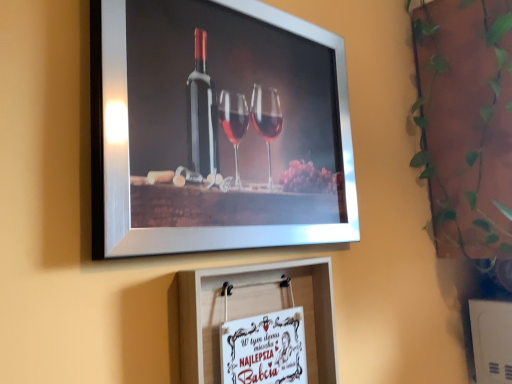
Question: Does white paper at center, arranged as the 2th picture frame when viewed from the top, appear on the left side of metallic silver picture frame at upper center, the 1th picture frame from the top?

Choices:
 (A) no
 (B) yes

Answer: (A)

Question: Is white paper at center, placed as the 1th picture frame when sorted from bottom to top, positioned behind metallic silver picture frame at upper center, the 1th picture frame from the top?

Choices:
 (A) yes
 (B) no

Answer: (A)

Question: Can you confirm if white paper at center, placed as the 1th picture frame when sorted from bottom to top, is smaller than metallic silver picture frame at upper center, the 1th picture frame from the top?

Choices:
 (A) yes
 (B) no

Answer: (A)

Question: From the image's perspective, is white paper at center, placed as the 1th picture frame when sorted from bottom to top, beneath metallic silver picture frame at upper center, the 1th picture frame from the top?

Choices:
 (A) no
 (B) yes

Answer: (B)

Question: From the image's perspective, is white paper at center, arranged as the 2th picture frame when viewed from the top, above metallic silver picture frame at upper center, the 1th picture frame from the top?

Choices:
 (A) no
 (B) yes

Answer: (A)

Question: Looking at the image, does green leafy plant at upper right seem bigger or smaller compared to white paper at center, arranged as the 2th picture frame when viewed from the top?

Choices:
 (A) big
 (B) small

Answer: (A)

Question: From a real-world perspective, is green leafy plant at upper right positioned above or below white paper at center, arranged as the 2th picture frame when viewed from the top?

Choices:
 (A) below
 (B) above

Answer: (B)

Question: Looking at their shapes, would you say green leafy plant at upper right is wider or thinner than white paper at center, placed as the 1th picture frame when sorted from bottom to top?

Choices:
 (A) thin
 (B) wide

Answer: (B)

Question: Is green leafy plant at upper right in front of or behind white paper at center, placed as the 1th picture frame when sorted from bottom to top, in the image?

Choices:
 (A) front
 (B) behind

Answer: (B)

Question: Do you think green leafy plant at upper right is within metallic silver picture frame at upper center, placed as the second picture frame when sorted from bottom to top, or outside of it?

Choices:
 (A) inside
 (B) outside

Answer: (B)

Question: Considering their positions, is green leafy plant at upper right located in front of or behind metallic silver picture frame at upper center, placed as the second picture frame when sorted from bottom to top?

Choices:
 (A) behind
 (B) front

Answer: (A)

Question: Considering the positions of green leafy plant at upper right and metallic silver picture frame at upper center, the 1th picture frame from the top, in the image, is green leafy plant at upper right wider or thinner than metallic silver picture frame at upper center, the 1th picture frame from the top,?

Choices:
 (A) thin
 (B) wide

Answer: (B)

Question: Considering the positions of point (437, 231) and point (118, 64), is point (437, 231) closer or farther from the camera than point (118, 64)?

Choices:
 (A) farther
 (B) closer

Answer: (A)

Question: Considering the positions of metallic silver picture frame at upper center, placed as the second picture frame when sorted from bottom to top, and white paper at center, arranged as the 2th picture frame when viewed from the top, in the image, is metallic silver picture frame at upper center, placed as the second picture frame when sorted from bottom to top, taller or shorter than white paper at center, arranged as the 2th picture frame when viewed from the top,?

Choices:
 (A) tall
 (B) short

Answer: (A)

Question: In terms of width, does metallic silver picture frame at upper center, the 1th picture frame from the top, look wider or thinner when compared to white paper at center, placed as the 1th picture frame when sorted from bottom to top?

Choices:
 (A) thin
 (B) wide

Answer: (A)